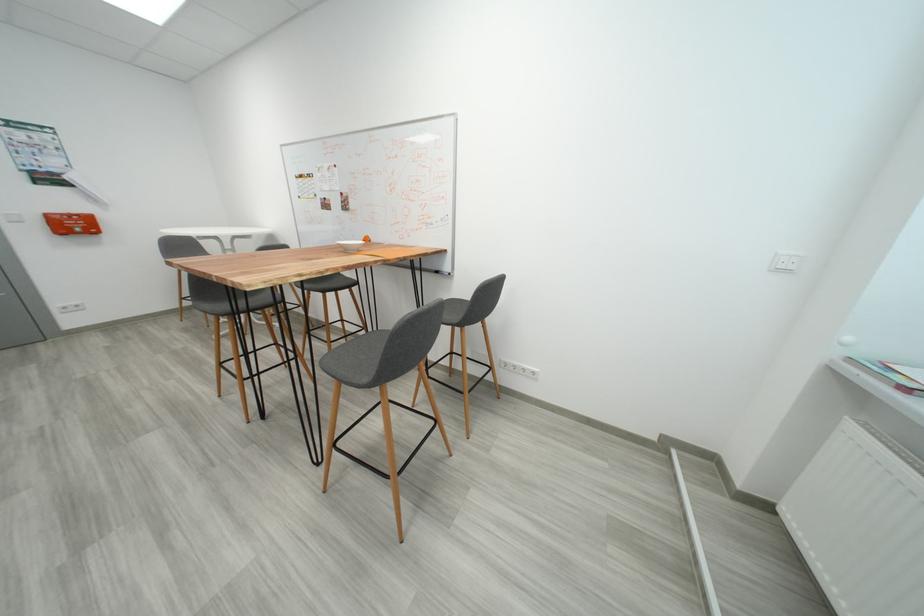
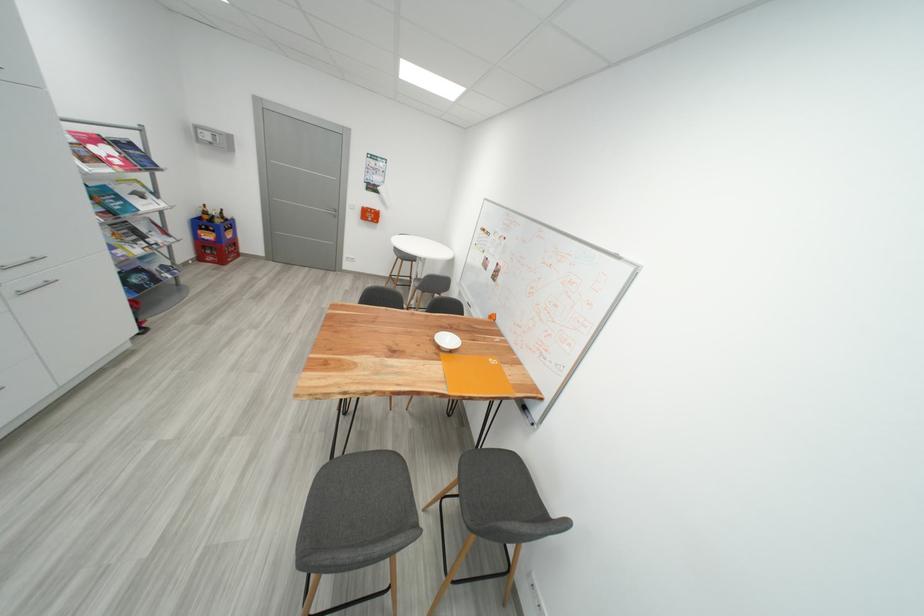
Question: How did the camera likely rotate?

Choices:
 (A) Left
 (B) Right
 (C) Up
 (D) Down

Answer: (A)